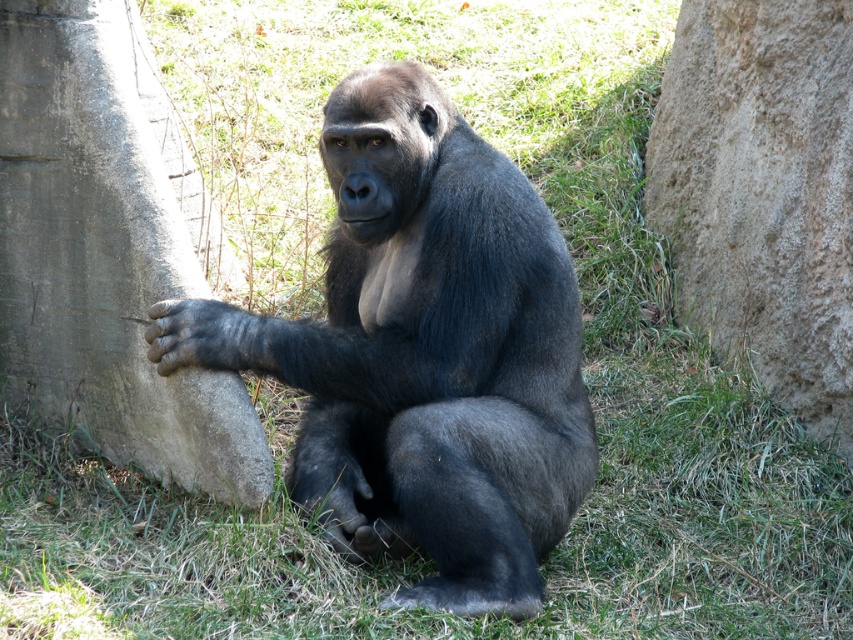
Question: Considering the real-world distances, which object is closest to the black furry paw at lower left?

Choices:
 (A) gray rough rock at right
 (B) gray concrete tree trunk at left
 (C) shiny black gorilla at center

Answer: (B)

Question: Does shiny black gorilla at center have a smaller size compared to black furry paw at lower left?

Choices:
 (A) yes
 (B) no

Answer: (B)

Question: Which point appears closest to the camera in this image?

Choices:
 (A) (386, 225)
 (B) (467, 125)
 (C) (221, 310)

Answer: (A)

Question: Among these points, which one is nearest to the camera?

Choices:
 (A) (4, 180)
 (B) (373, 220)

Answer: (B)

Question: Is black furry paw at lower left thinner than black matte mouth at center?

Choices:
 (A) no
 (B) yes

Answer: (A)

Question: Is gray rough rock at right wider than black furry paw at lower left?

Choices:
 (A) yes
 (B) no

Answer: (A)